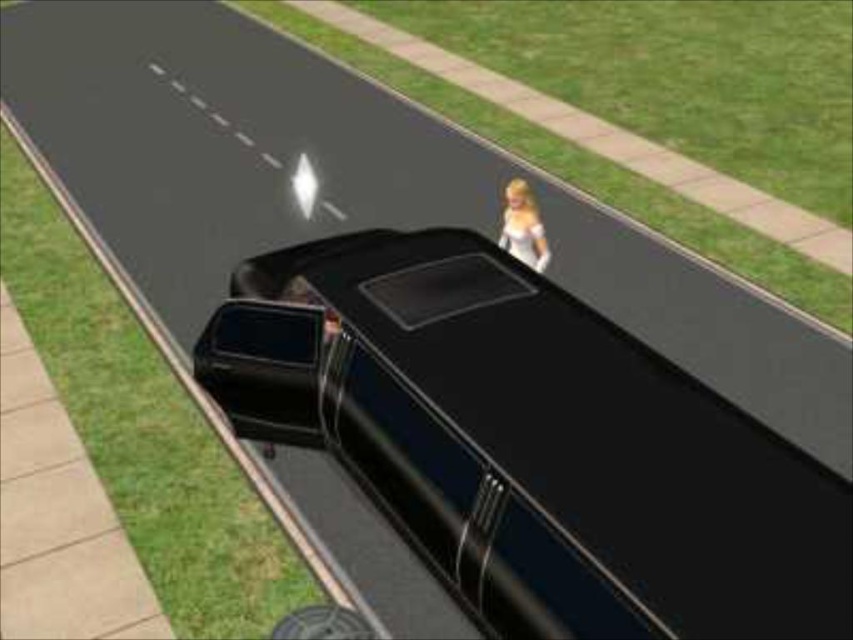
You are a pedestrian standing on the sidewalk next to the glossy black car at center and the blonde hair doll at center. Which object is closer to the road?

The glossy black car at center is closer to the road because it is positioned under the blonde hair doll at center, meaning the car is between the doll and the road.